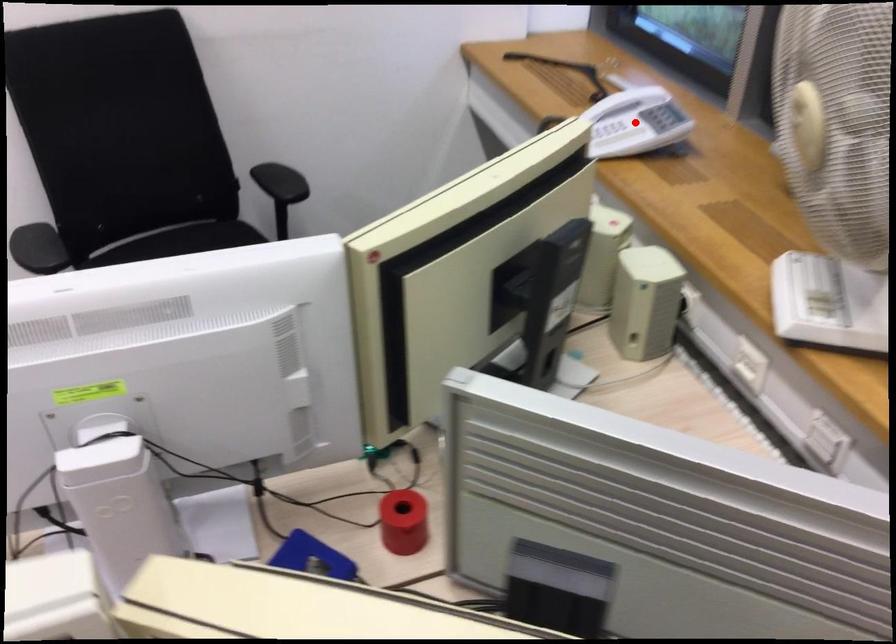
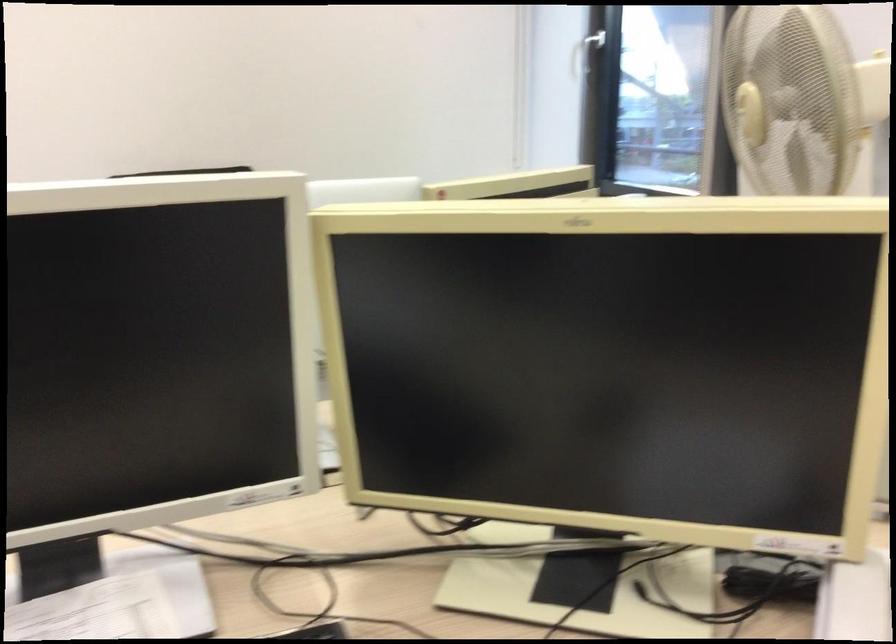
Question: I am providing you with two images of the same scene from different viewpoints. A red point is marked on the first image. Is the red point's position out of view in image 2?

Choices:
 (A) Yes
 (B) No

Answer: (A)